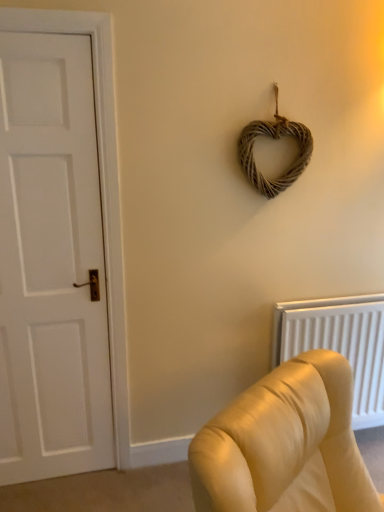
Question: Considering the positions of point (309, 312) and point (266, 181), is point (309, 312) closer or farther from the camera than point (266, 181)?

Choices:
 (A) closer
 (B) farther

Answer: (B)

Question: Is white textured radiator at lower right taller or shorter than woven natural heart at upper center?

Choices:
 (A) short
 (B) tall

Answer: (B)

Question: Based on their relative distances, which object is nearer to the white textured radiator at lower right?

Choices:
 (A) white matte door at left
 (B) woven natural heart at upper center

Answer: (B)

Question: Estimate the real-world distances between objects in this image. Which object is farther from the white matte door at left?

Choices:
 (A) woven natural heart at upper center
 (B) white textured radiator at lower right

Answer: (B)